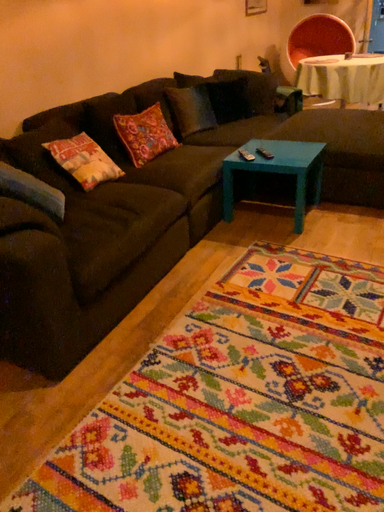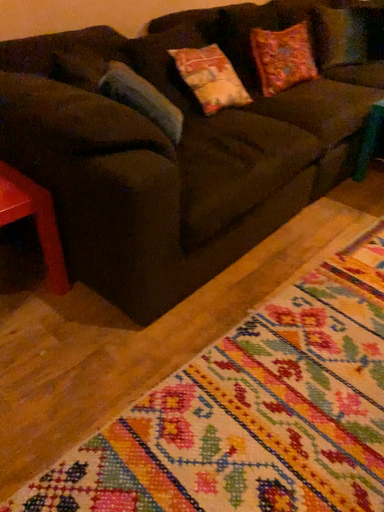
Question: Which way did the camera rotate in the video?

Choices:
 (A) rotated left
 (B) rotated right

Answer: (A)